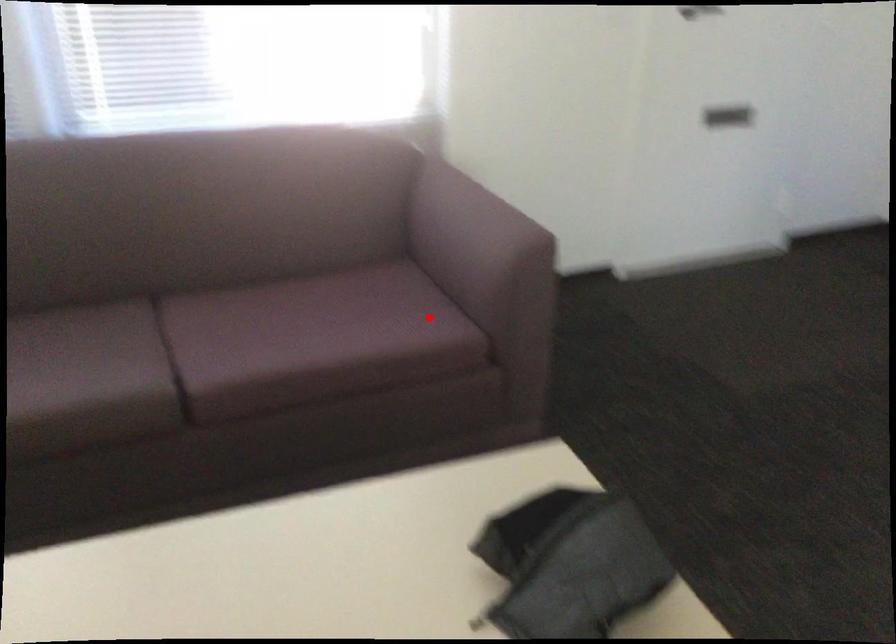
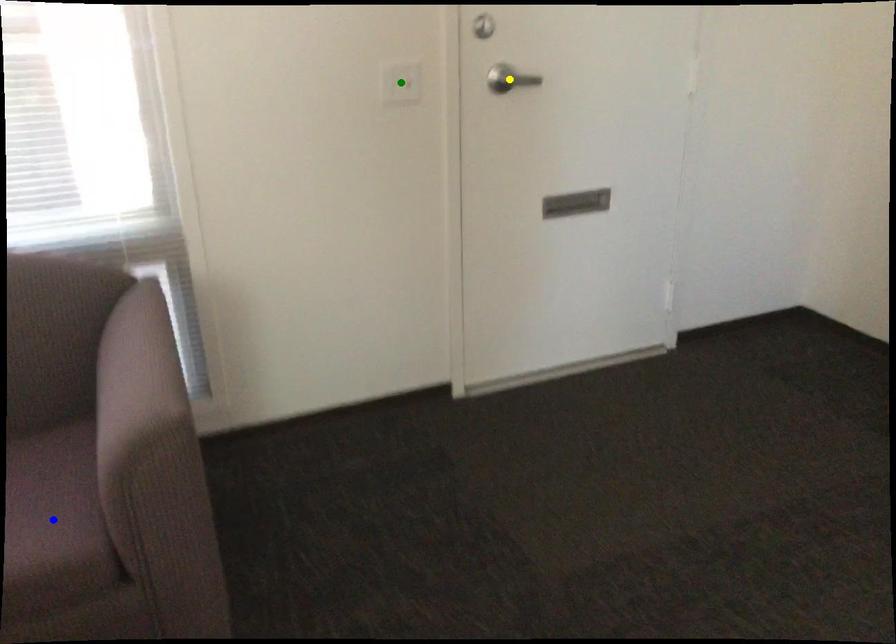
Question: I am providing you with two images of the same scene from different viewpoints. A red point is marked on the first image. You are given multiple points on the second image. Which point in image 2 represents the same 3d spot as the red point in image 1?

Choices:
 (A) yellow point
 (B) green point
 (C) blue point

Answer: (C)